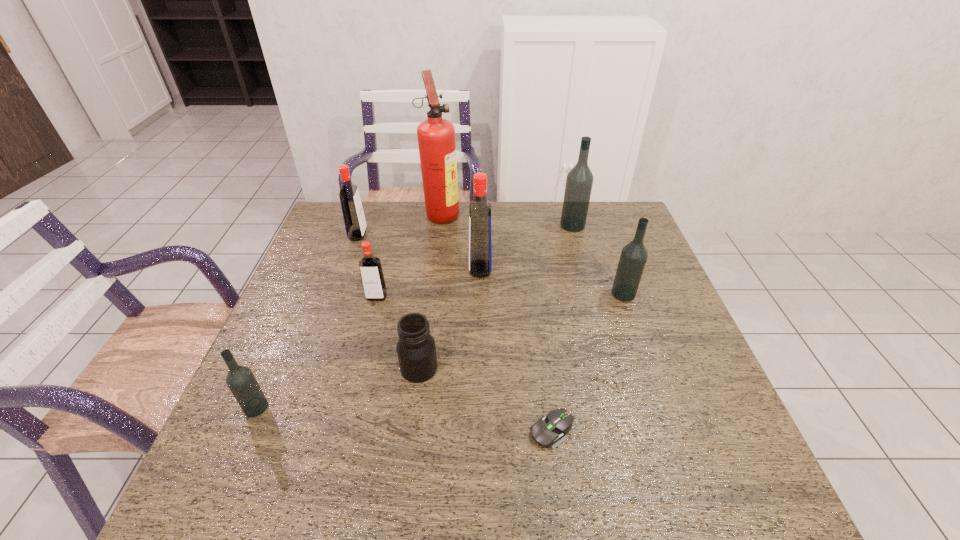
Locate an element on the screen. red fire extinguisher is located at coordinates (436, 136).

At what (x,y) coordinates should I click in order to perform the action: click on the tallest object. Please return your answer as a coordinate pair (x, y). Looking at the image, I should click on (436, 136).

In order to click on the biggest black vodka in this screenshot , I will do `click(579, 181)`.

I want to click on the second vodka from right to left, so click(579, 181).

You are a GUI agent. You are given a task and a screenshot of the screen. Output one action in this format:
    pyautogui.click(x=<x>, y=<y>)
    Task: Click on the biggest red vodka
    
    Given the screenshot: What is the action you would take?
    pyautogui.click(x=480, y=244)

Where is `the sixth nearest object`? This screenshot has width=960, height=540. the sixth nearest object is located at coordinates (480, 244).

At what (x,y) coordinates should I click in order to perform the action: click on the farthest red vodka. Please return your answer as a coordinate pair (x, y). Looking at the image, I should click on (355, 224).

I want to click on the second vodka from left to right, so click(355, 224).

Where is `the second smallest black vodka`? This screenshot has width=960, height=540. the second smallest black vodka is located at coordinates (634, 255).

Where is `the rightmost black vodka`? the rightmost black vodka is located at coordinates (634, 255).